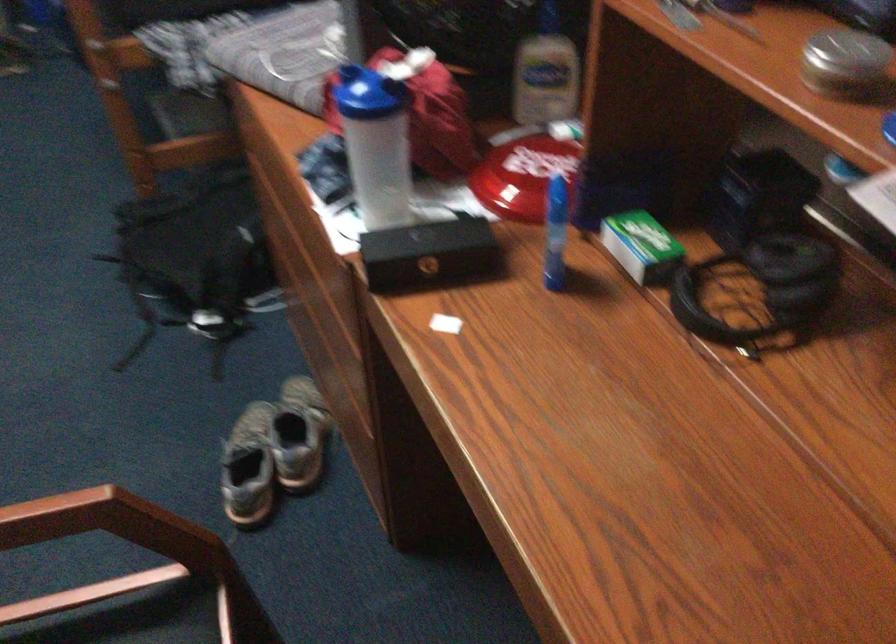
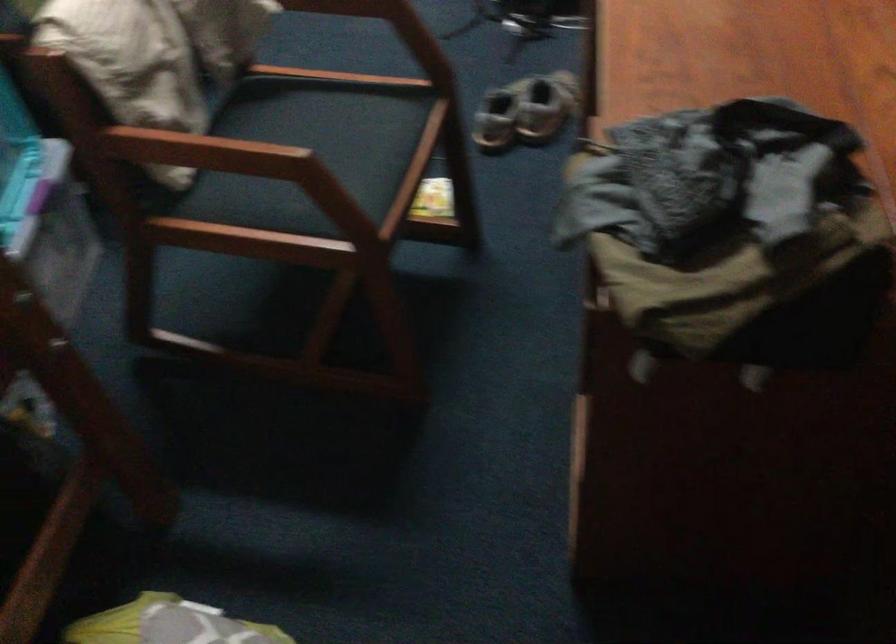
Question: The camera is either moving clockwise (left) or counter-clockwise (right) around the object. The first image is from the beginning of the video and the second image is from the end. Is the camera moving left or right when shooting the video?

Choices:
 (A) Left
 (B) Right

Answer: (B)